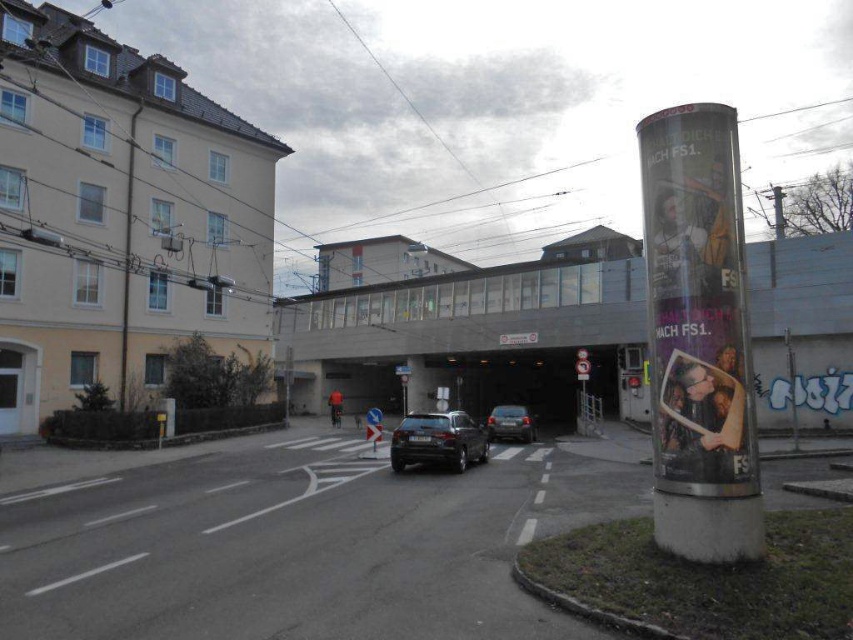
Measure the distance between satin black suv at center and shiny silver sedan at center.

satin black suv at center is 9.47 meters from shiny silver sedan at center.

Is satin black suv at center to the left of shiny silver sedan at center from the viewer's perspective?

Correct, you'll find satin black suv at center to the left of shiny silver sedan at center.

Does point (426, 436) come in front of point (503, 433)?

Yes, point (426, 436) is closer to viewer.

The height and width of the screenshot is (640, 853). What are the coordinates of `satin black suv at center` in the screenshot? It's located at (438, 440).

Which is in front, point (741, 433) or point (123, 401)?

Point (741, 433)

Is white glossy pillar at right shorter than metallic wire at left?

Yes, white glossy pillar at right is shorter than metallic wire at left.

Which is behind, point (675, 312) or point (131, 202)?

The point (131, 202) is more distant.

Image resolution: width=853 pixels, height=640 pixels. I want to click on white glossy pillar at right, so click(x=698, y=337).

Is metallic wire at left in front of shiny silver sedan at center?

No, metallic wire at left is behind shiny silver sedan at center.

Between metallic wire at left and shiny silver sedan at center, which one appears on the right side from the viewer's perspective?

shiny silver sedan at center

Is point (128, 285) less distant than point (521, 432)?

No, (128, 285) is further to viewer.

Find the location of a particular element. The width and height of the screenshot is (853, 640). metallic wire at left is located at coordinates (126, 253).